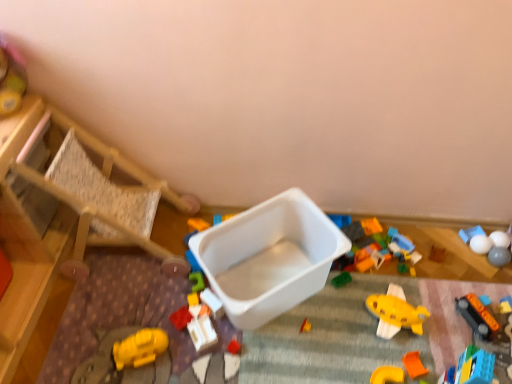
Find the location of a particular element. The image size is (512, 384). vacant space behind white glossy ball at upper right, the fourth toy positioned from the right is located at coordinates (466, 232).